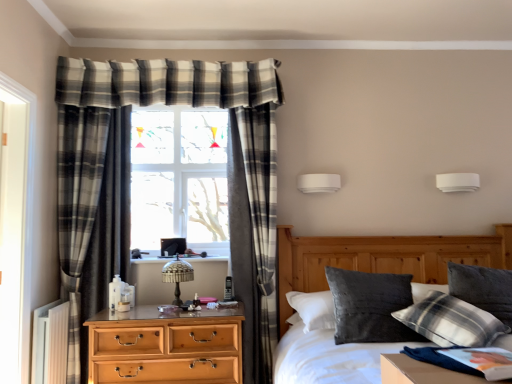
The width and height of the screenshot is (512, 384). Describe the element at coordinates (458, 182) in the screenshot. I see `white matte wall sconce at upper center` at that location.

The height and width of the screenshot is (384, 512). Find the location of `white matte wall sconce at upper center`. white matte wall sconce at upper center is located at coordinates (458, 182).

What do you see at coordinates (382, 258) in the screenshot? I see `velvet grey pillow at center` at bounding box center [382, 258].

Find the location of a particular element. This screenshot has width=512, height=384. white glossy screen door at left is located at coordinates (15, 227).

Locate an element on the screen. This screenshot has width=512, height=384. white plastic radiator at lower left is located at coordinates (50, 343).

The image size is (512, 384). Find the location of `plaid fabric curtain at center`. plaid fabric curtain at center is located at coordinates (253, 229).

Does velvet grey pillow at center have a lesser height compared to white glossy screen door at left?

Yes.

Considering the points (474, 239) and (2, 197), which point is behind, point (474, 239) or point (2, 197)?

The point (474, 239) is farther from the camera.

Is velvet grey pillow at center with white glossy screen door at left?

velvet grey pillow at center and white glossy screen door at left are clearly separated.

How different are the orientations of translucent glass table lamp at center and velvet grey pillow at center in degrees?

They differ by 3.62 degrees in their facing directions.

This screenshot has width=512, height=384. In order to click on bed that is in front of the translucent glass table lamp at center in this screenshot , I will do `click(382, 258)`.

Is translucent glass table lamp at center situated inside velvet grey pillow at center or outside?

translucent glass table lamp at center is not inside velvet grey pillow at center, it's outside.

Which is in front, translucent glass table lamp at center or velvet grey pillow at center?

velvet grey pillow at center is more forward.

Which point is more distant from viewer, (22, 283) or (252, 139)?

The point (252, 139) is behind.

Is the depth of white glossy screen door at left greater than that of plaid fabric curtain at center?

No, it is not.

Can you confirm if white glossy screen door at left is wider than plaid fabric curtain at center?

No, white glossy screen door at left is not wider than plaid fabric curtain at center.

From the image's perspective, does translucent glass table lamp at center appear higher than plaid fabric curtain at center?

Actually, translucent glass table lamp at center appears below plaid fabric curtain at center in the image.

Which is closer to the camera, (168, 279) or (248, 174)?

Point (168, 279).

Which is more to the left, translucent glass table lamp at center or plaid fabric curtain at center?

translucent glass table lamp at center.

Considering the relative sizes of translucent glass table lamp at center and plaid fabric curtain at center in the image provided, is translucent glass table lamp at center shorter than plaid fabric curtain at center?

Correct, translucent glass table lamp at center is not as tall as plaid fabric curtain at center.

From the image's perspective, is white glossy screen door at left located beneath plaid fabric pillow at upper right, the 2th pillow viewed from the left?

No, from the image's perspective, white glossy screen door at left is not below plaid fabric pillow at upper right, the 2th pillow viewed from the left.

Is the depth of white glossy screen door at left greater than that of plaid fabric pillow at upper right, the 2th pillow viewed from the left?

No, it is not.

How far apart are white glossy screen door at left and plaid fabric pillow at upper right, which is the 1th pillow from right to left?

white glossy screen door at left is 8.41 feet away from plaid fabric pillow at upper right, which is the 1th pillow from right to left.

Is white glossy screen door at left facing towards plaid fabric pillow at upper right, the 2th pillow viewed from the left?

Yes, white glossy screen door at left is oriented towards plaid fabric pillow at upper right, the 2th pillow viewed from the left.

From a real-world perspective, does white plastic radiator at lower left sit lower than light brown wooden chest of drawers at center left?

Actually, white plastic radiator at lower left is physically above light brown wooden chest of drawers at center left in the real world.

Considering the sizes of objects white plastic radiator at lower left and light brown wooden chest of drawers at center left in the image provided, who is thinner, white plastic radiator at lower left or light brown wooden chest of drawers at center left?

white plastic radiator at lower left is thinner.

From the image's perspective, which is below, white plastic radiator at lower left or light brown wooden chest of drawers at center left?

white plastic radiator at lower left, from the image's perspective.

Does point (44, 311) appear closer or farther from the camera than point (213, 311)?

Point (44, 311).

Which point is more forward, (167, 270) or (202, 345)?

The point (202, 345) is closer.

Is translucent glass table lamp at center closer to camera compared to light brown wooden chest of drawers at center left?

No.

From their relative heights in the image, would you say translucent glass table lamp at center is taller or shorter than light brown wooden chest of drawers at center left?

In the image, translucent glass table lamp at center appears to be shorter than light brown wooden chest of drawers at center left.

From a real-world perspective, between translucent glass table lamp at center and light brown wooden chest of drawers at center left, who is vertically higher?

In real-world perspective, translucent glass table lamp at center is above.

Locate an element on the screen. The image size is (512, 384). bed on the right of the white glossy screen door at left is located at coordinates (382, 258).

Where is `table lamp behind the velvet grey pillow at center`? The image size is (512, 384). table lamp behind the velvet grey pillow at center is located at coordinates (177, 276).

Looking at the image, which one is located further to white glossy screen door at left, white plastic radiator at lower left or translucent glass table lamp at center?

translucent glass table lamp at center is positioned further to the anchor white glossy screen door at left.

Based on their spatial positions, is light brown wooden chest of drawers at center left or plaid fabric pillow at upper right, the 2th pillow viewed from the left, further from translucent glass table lamp at center?

Based on the image, plaid fabric pillow at upper right, the 2th pillow viewed from the left, appears to be further to translucent glass table lamp at center.

Looking at the image, which one is located further to velvet grey pillow at center, translucent glass table lamp at center or plaid fabric pillow at upper right, which is the 1th pillow from right to left?

Among the two, translucent glass table lamp at center is located further to velvet grey pillow at center.

When comparing their distances from white plastic radiator at lower left, does white matte wall sconce at upper center or plaid fabric pillow at upper right, the 2th pillow viewed from the left, seem closer?

plaid fabric pillow at upper right, the 2th pillow viewed from the left.

From the image, which object appears to be nearer to white plastic radiator at lower left, plaid fabric curtain at center or plaid fabric pillow at upper right, the 2th pillow viewed from the left?

Among the two, plaid fabric curtain at center is located nearer to white plastic radiator at lower left.

When comparing their distances from velvety dark gray pillow at center-right, the 1th pillow from the left, does light brown wooden chest of drawers at center left or plaid fabric pillow at upper right, the 2th pillow viewed from the left, seem closer?

Based on the image, plaid fabric pillow at upper right, the 2th pillow viewed from the left, appears to be nearer to velvety dark gray pillow at center-right, the 1th pillow from the left.

Looking at the image, which one is located further to plaid fabric curtain at center, velvety dark gray pillow at center-right, the 1th pillow from the left, or white plastic radiator at lower left?

white plastic radiator at lower left is positioned further to the anchor plaid fabric curtain at center.

Estimate the real-world distances between objects in this image. Which object is further from light brown wooden chest of drawers at center left, velvet grey pillow at center or velvety dark gray pillow at center-right, marked as the second pillow in a right-to-left arrangement?

velvet grey pillow at center is positioned further to the anchor light brown wooden chest of drawers at center left.

The image size is (512, 384). What are the coordinates of `table lamp between white plastic radiator at lower left and velvet grey pillow at center from left to right` in the screenshot? It's located at (177, 276).

This screenshot has height=384, width=512. In order to click on curtain between translucent glass table lamp at center and velvety dark gray pillow at center-right, the 1th pillow from the left, from left to right in this screenshot , I will do `click(253, 229)`.

This screenshot has width=512, height=384. Identify the location of pillow positioned between velvety dark gray pillow at center-right, marked as the second pillow in a right-to-left arrangement, and white matte wall sconce at upper center from near to far. (483, 289).

Where is `radiator between white glossy screen door at left and plaid fabric pillow at upper right, the 2th pillow viewed from the left`? The image size is (512, 384). radiator between white glossy screen door at left and plaid fabric pillow at upper right, the 2th pillow viewed from the left is located at coordinates tap(50, 343).